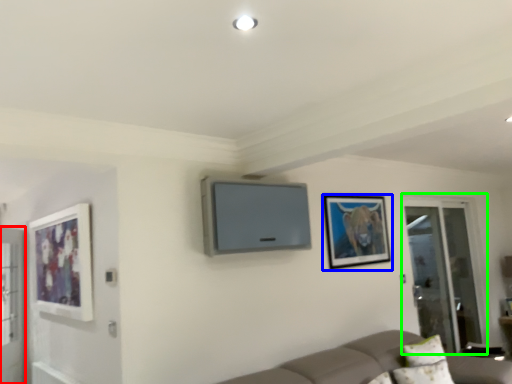
Question: Which is farther away from screen door (highlighted by a red box)? picture frame (highlighted by a blue box) or screen door (highlighted by a green box)?

Choices:
 (A) picture frame
 (B) screen door

Answer: (B)